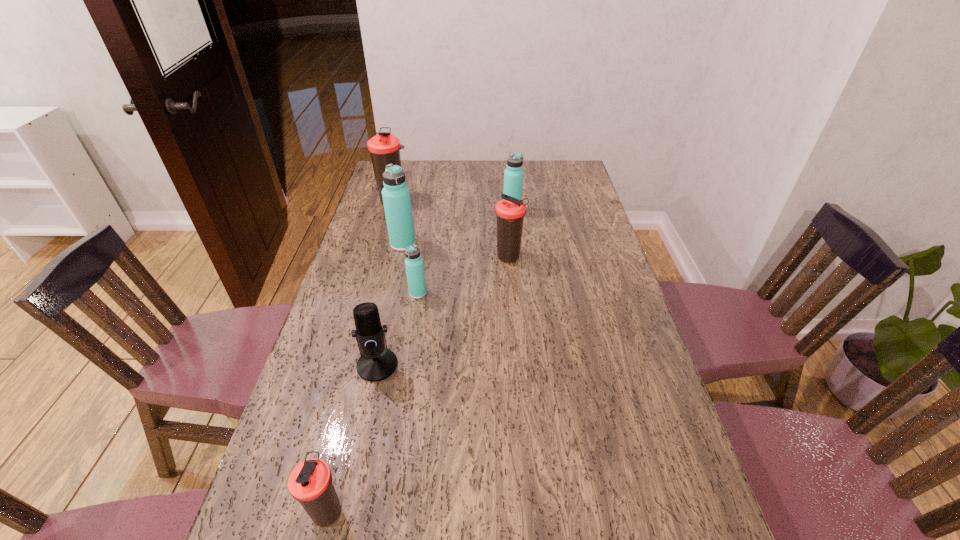
This screenshot has height=540, width=960. In order to click on the farthest brown thermos bottle in this screenshot , I will do `click(384, 148)`.

I want to click on the biggest aqua thermos bottle, so click(396, 195).

The image size is (960, 540). I want to click on the second nearest aqua thermos bottle, so click(x=396, y=195).

You are a GUI agent. You are given a task and a screenshot of the screen. Output one action in this format:
    pyautogui.click(x=<x>, y=<y>)
    Task: Click on the second biggest brown thermos bottle
    
    Given the screenshot: What is the action you would take?
    pyautogui.click(x=510, y=212)

Where is `the second nearest brown thermos bottle`? The image size is (960, 540). the second nearest brown thermos bottle is located at coordinates (510, 212).

This screenshot has height=540, width=960. Find the location of `the second smallest aqua thermos bottle`. the second smallest aqua thermos bottle is located at coordinates (513, 175).

Image resolution: width=960 pixels, height=540 pixels. Find the location of `the rightmost aqua thermos bottle`. the rightmost aqua thermos bottle is located at coordinates (513, 175).

The width and height of the screenshot is (960, 540). Find the location of `black microphone`. black microphone is located at coordinates [376, 363].

In order to click on microphone in this screenshot , I will do `click(376, 363)`.

Image resolution: width=960 pixels, height=540 pixels. Find the location of `the third nearest object`. the third nearest object is located at coordinates (414, 265).